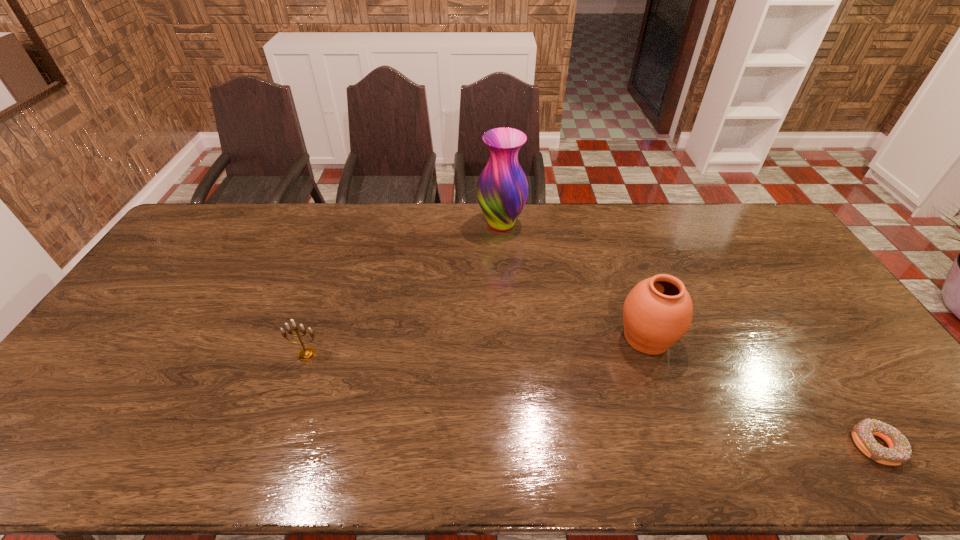
You are a GUI agent. You are given a task and a screenshot of the screen. Output one action in this format:
    pyautogui.click(x=<x>, y=<y>)
    Task: Click on the free point located on the front of the candelabrum
    
    Given the screenshot: What is the action you would take?
    pyautogui.click(x=299, y=377)

This screenshot has width=960, height=540. I want to click on vacant region located 0.350m on the left of the doughnut, so click(702, 446).

Locate an element on the screen. Image resolution: width=960 pixels, height=540 pixels. object at the far edge is located at coordinates point(502,189).

Find the location of a particular element. This screenshot has width=960, height=540. object located in the near edge section of the desktop is located at coordinates (899, 452).

This screenshot has width=960, height=540. I want to click on object that is positioned at the right edge, so click(x=899, y=452).

The height and width of the screenshot is (540, 960). Identify the location of object present at the near right corner. [899, 452].

Locate an element on the screen. The image size is (960, 540). vacant space at the far edge of the desktop is located at coordinates (344, 230).

This screenshot has width=960, height=540. I want to click on vacant area at the near edge of the desktop, so click(x=113, y=468).

At what (x,y) coordinates should I click in order to perform the action: click on vacant space at the right edge of the desktop. Please return your answer as a coordinate pair (x, y). Looking at the image, I should click on click(755, 250).

Where is `vacant space at the far left corner of the desktop`? Image resolution: width=960 pixels, height=540 pixels. vacant space at the far left corner of the desktop is located at coordinates (205, 228).